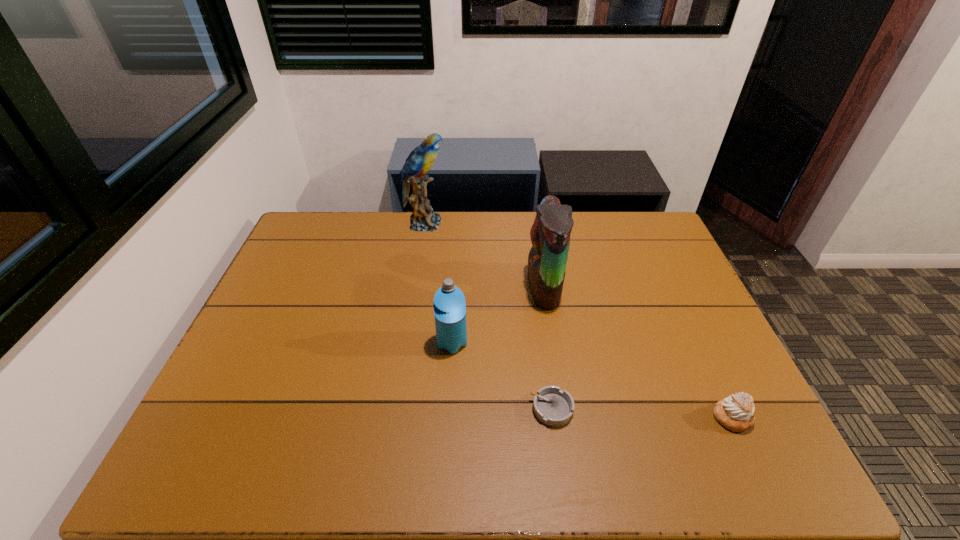
Where is `the farther parrot`? This screenshot has width=960, height=540. the farther parrot is located at coordinates (421, 159).

At what (x,y) coordinates should I click in order to perform the action: click on the taller parrot. Please return your answer as a coordinate pair (x, y). The image size is (960, 540). Looking at the image, I should click on (421, 159).

At what (x,y) coordinates should I click in order to perform the action: click on the fourth nearest object. Please return your answer as a coordinate pair (x, y). The width and height of the screenshot is (960, 540). Looking at the image, I should click on (550, 233).

Where is `the shorter parrot`? the shorter parrot is located at coordinates (550, 233).

I want to click on the second object from left to right, so click(x=449, y=303).

Identify the location of the third nearest object. (449, 303).

I want to click on the second shortest object, so click(x=736, y=412).

The height and width of the screenshot is (540, 960). What are the coordinates of `pastry` in the screenshot? It's located at (736, 412).

You are a GUI agent. You are given a task and a screenshot of the screen. Output one action in this format:
    pyautogui.click(x=<x>, y=<y>)
    Task: Click on the ashtray
    
    Given the screenshot: What is the action you would take?
    pyautogui.click(x=553, y=407)

Find the location of a particular element. The height and width of the screenshot is (540, 960). free region located 0.070m on the face of the farthest object is located at coordinates (467, 223).